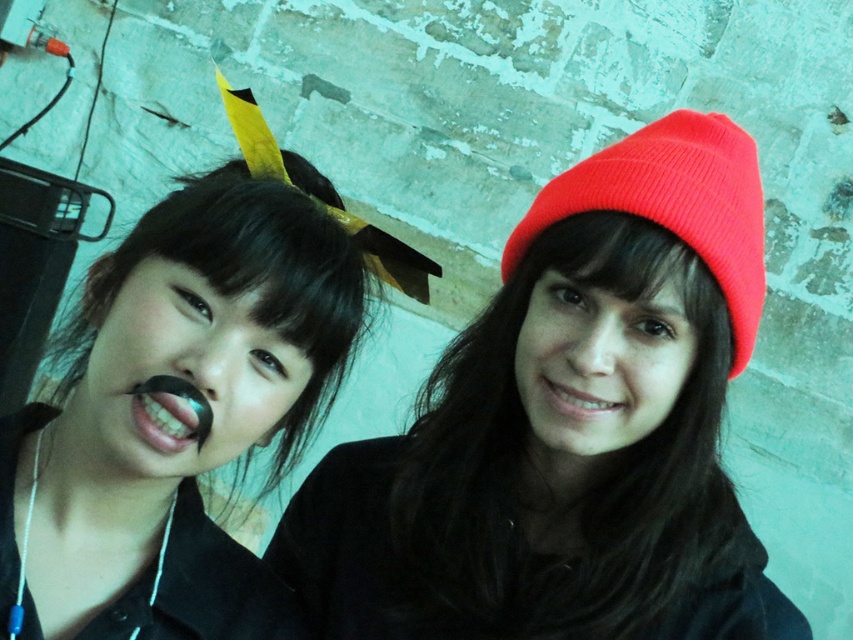
Where is `red knit beanie at right`? The height and width of the screenshot is (640, 853). red knit beanie at right is located at coordinates (674, 204).

Is red knit beanie at right taller than black matte nose at center?

Yes, red knit beanie at right is taller than black matte nose at center.

Locate an element on the screen. The image size is (853, 640). red knit beanie at right is located at coordinates (674, 204).

Between black matte hairpin at upper left and white glossy teeth at center, which one appears on the right side from the viewer's perspective?

white glossy teeth at center is more to the right.

Is black matte hairpin at upper left taller than white glossy teeth at center?

Yes, black matte hairpin at upper left is taller than white glossy teeth at center.

Measure the distance between point (224, 212) and camera.

The distance of point (224, 212) from camera is 83.34 centimeters.

This screenshot has height=640, width=853. Identify the location of black matte hairpin at upper left. (167, 394).

Looking at this image, which is above, red knit beanie at right or teethsmoothmouth at left?

Positioned higher is red knit beanie at right.

Based on the photo, does red knit beanie at right have a greater height compared to teethsmoothmouth at left?

Correct, red knit beanie at right is much taller as teethsmoothmouth at left.

You are a GUI agent. You are given a task and a screenshot of the screen. Output one action in this format:
    pyautogui.click(x=<x>, y=<y>)
    Task: Click on the red knit beanie at right
    The width and height of the screenshot is (853, 640).
    Given the screenshot: What is the action you would take?
    pyautogui.click(x=674, y=204)